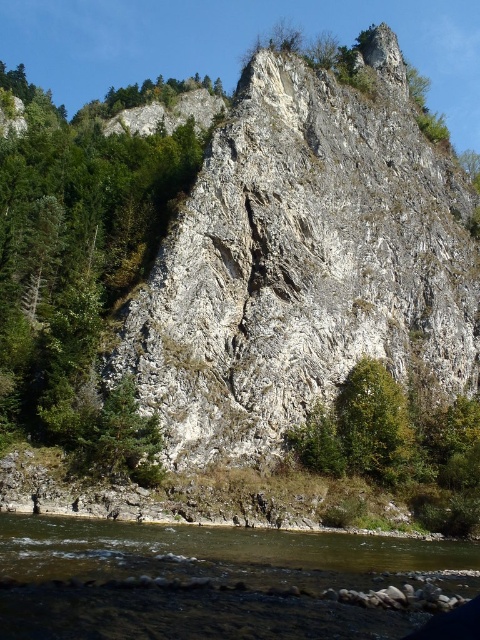
Does green leafy tree at center have a greater width compared to brown rocky river at lower center?

Yes.

Does green leafy tree at center have a smaller size compared to brown rocky river at lower center?

Incorrect, green leafy tree at center is not smaller in size than brown rocky river at lower center.

Who is more distant from viewer, (4,416) or (20,518)?

Positioned behind is point (4,416).

The height and width of the screenshot is (640, 480). What are the coordinates of `green leafy tree at center` in the screenshot? It's located at (79, 268).

Does white rough rock face at center have a greater width compared to brown rocky river at lower center?

Yes, white rough rock face at center is wider than brown rocky river at lower center.

Where is `white rough rock face at center`? This screenshot has width=480, height=640. white rough rock face at center is located at coordinates (303, 262).

Which is more to the left, white rough rock face at center or green leafy tree at center?

green leafy tree at center

Is white rough rock face at center closer to the viewer compared to green leafy tree at center?

No, it is not.

Where is `white rough rock face at center`? The image size is (480, 640). white rough rock face at center is located at coordinates (303, 262).